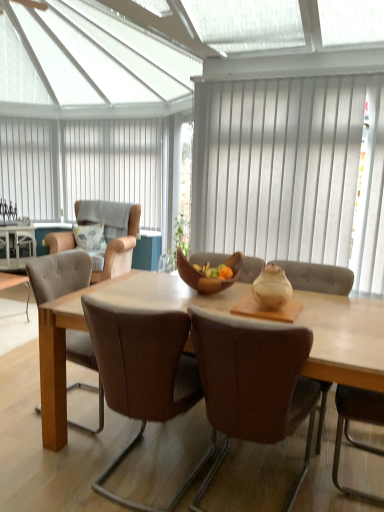
Locate an element on the screen. The image size is (384, 512). free space above white textured curtain at center, positioned as the 2th curtain in back-to-front order (from a real-world perspective) is located at coordinates (305, 65).